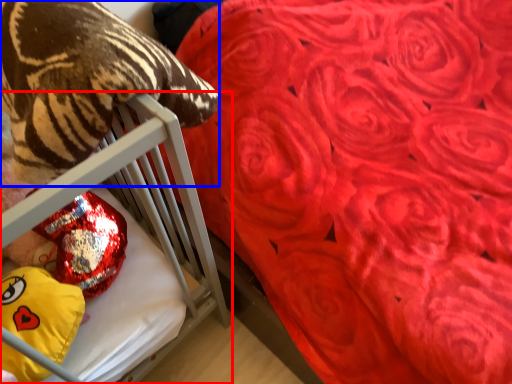
Question: Which of the following is the closest to the observer, furniture (highlighted by a red box) or animal (highlighted by a blue box)?

Choices:
 (A) furniture
 (B) animal

Answer: (B)